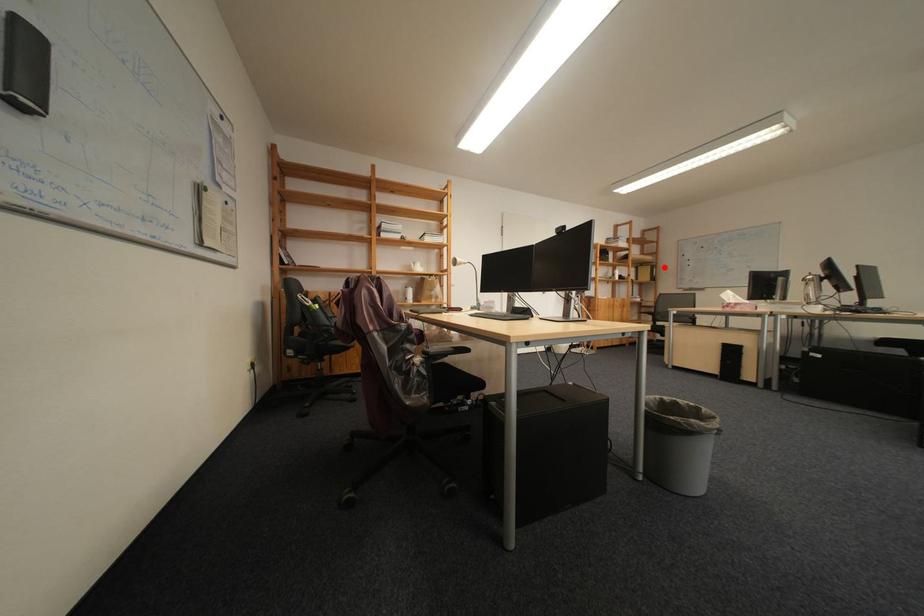
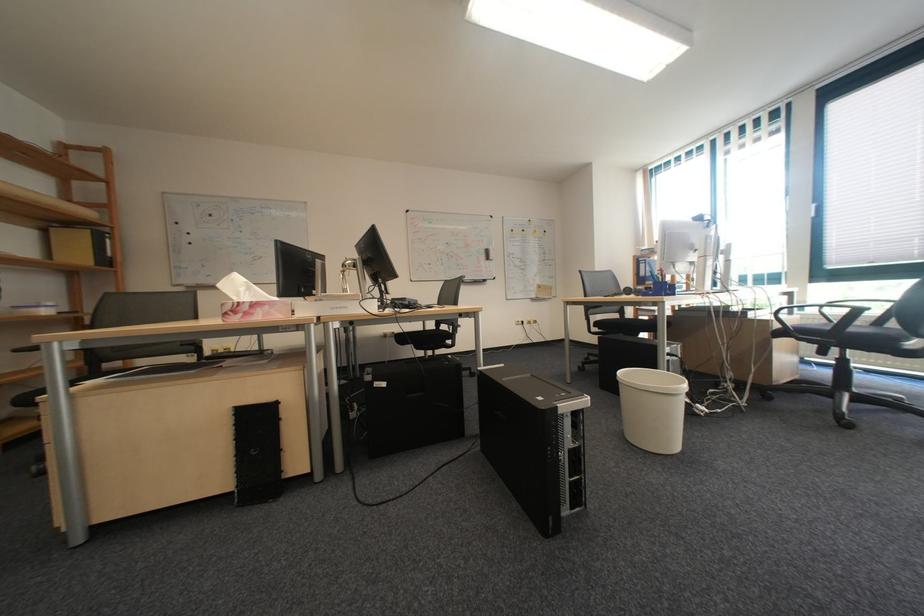
Question: I am providing you with two images of the same scene from different viewpoints. Image1 has a red point marked. In image2, the corresponding 3D location appears at what relative position? Reply with the corresponding letter.

Choices:
 (A) Closer
 (B) Farther

Answer: (B)